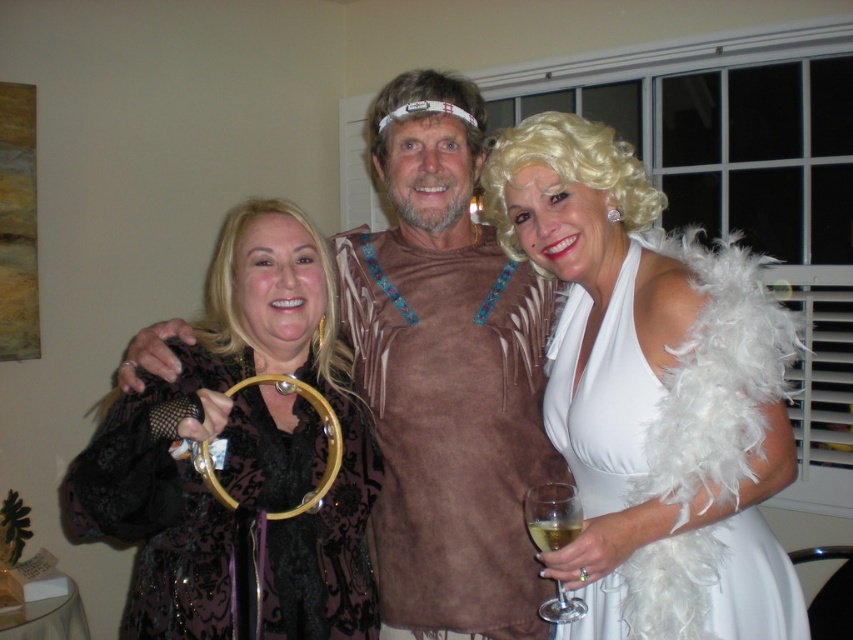
Question: Estimate the real-world distances between objects in this image. Which object is farther from the white feather boa at center?

Choices:
 (A) white feathered wig at center
 (B) blonde feather boa at right
 (C) suede-like brown vest at center

Answer: (A)

Question: Does blonde feather boa at right have a greater width compared to white feathered wig at center?

Choices:
 (A) yes
 (B) no

Answer: (A)

Question: Is white feather boa at center positioned in front of blonde feather boa at center?

Choices:
 (A) no
 (B) yes

Answer: (B)

Question: Among these points, which one is nearest to the camera?

Choices:
 (A) (543, 227)
 (B) (247, 337)

Answer: (B)

Question: Which is farther from the white feather boa at center?

Choices:
 (A) black lace tambourine at left
 (B) white feathered wig at center

Answer: (B)

Question: Is the position of white feather boa at center less distant than that of translucent glass at center?

Choices:
 (A) no
 (B) yes

Answer: (B)